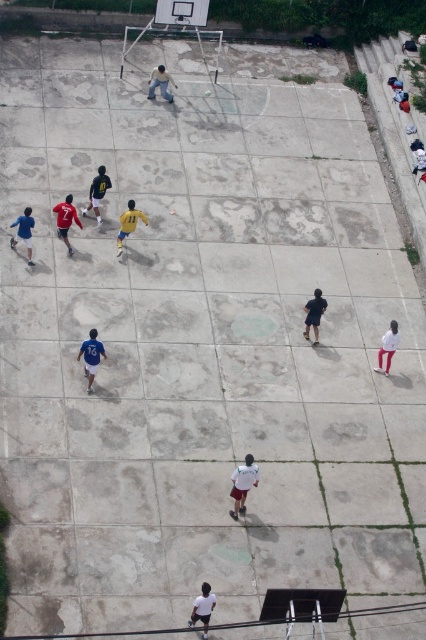
You are a photographer standing on the sidelines of the basketball court. You want to take a photo that includes both the matte red jersey at left and the blue fabric shirt at left. Which one should you pan your camera to the right to include in the frame first?

The matte red jersey at left is positioned on the right side of blue fabric shirt at left, so you should pan your camera to the right to include the blue fabric shirt at left first before capturing the matte red jersey at left.